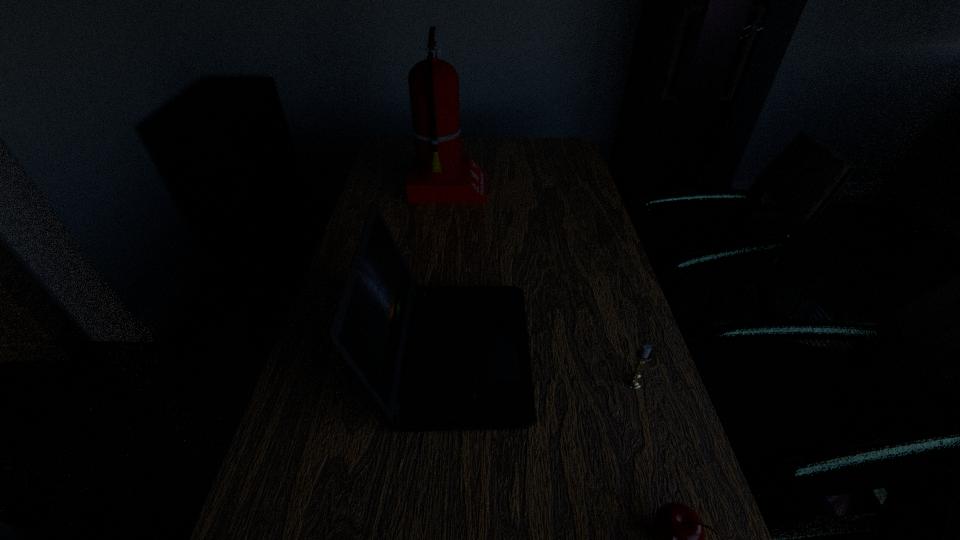
You are a GUI agent. You are given a task and a screenshot of the screen. Output one action in this format:
    pyautogui.click(x=<x>, y=<y>)
    Task: Click on the farthest object
    Image resolution: width=960 pixels, height=540 pixels.
    Given the screenshot: What is the action you would take?
    pyautogui.click(x=438, y=174)

You are a GUI agent. You are given a task and a screenshot of the screen. Output one action in this format:
    pyautogui.click(x=<x>, y=<y>)
    Task: Click on the fire extinguisher
    
    Given the screenshot: What is the action you would take?
    pyautogui.click(x=438, y=174)

The height and width of the screenshot is (540, 960). I want to click on laptop_computer, so click(x=434, y=358).

Identify the location of the second shortest object. (644, 355).

In order to click on vacant space located 0.150m on the front-facing side of the farthest object in this screenshot , I will do `click(529, 190)`.

Where is `vacant region located 0.210m on the screen of the laptop_computer`? This screenshot has height=540, width=960. vacant region located 0.210m on the screen of the laptop_computer is located at coordinates (620, 353).

Where is `vacant region located 0.230m on the left of the third tallest object`? The width and height of the screenshot is (960, 540). vacant region located 0.230m on the left of the third tallest object is located at coordinates (519, 382).

The width and height of the screenshot is (960, 540). I want to click on fire extinguisher that is at the left edge, so click(x=438, y=174).

Locate an element on the screen. laptop_computer positioned at the left edge is located at coordinates (434, 358).

I want to click on object that is at the right edge, so click(644, 355).